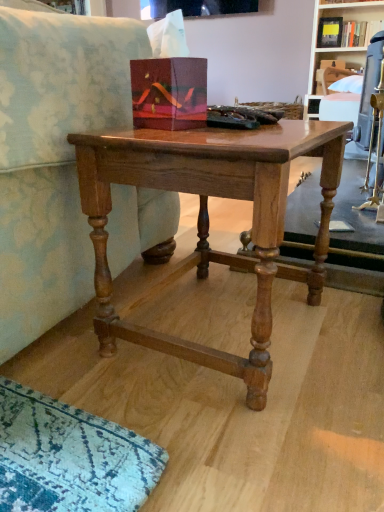
This screenshot has width=384, height=512. Find the location of `free spot below shiny brown wood table at center (from a real-world perspective)`. free spot below shiny brown wood table at center (from a real-world perspective) is located at coordinates (216, 322).